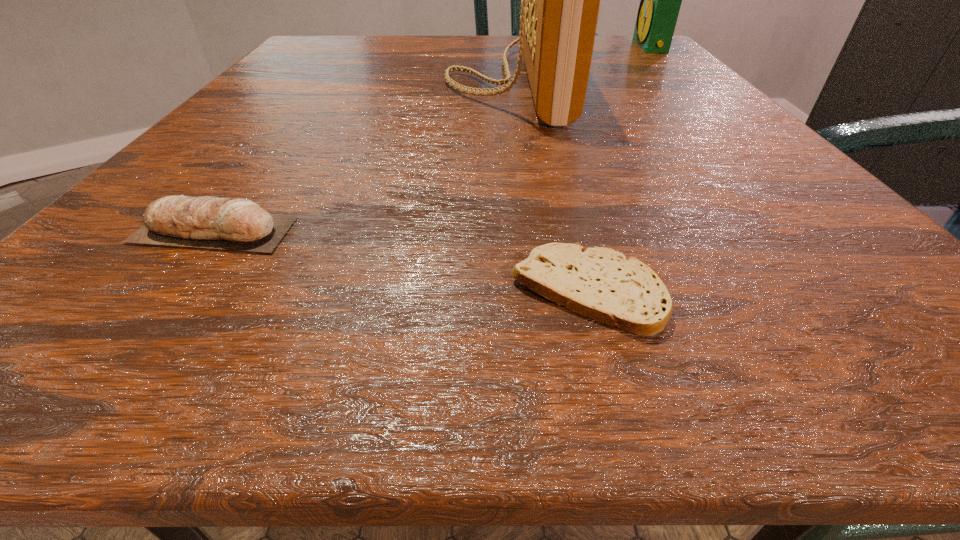
At what (x,y) coordinates should I click in order to perform the action: click on free region located on the front-facing side of the rightmost object. Please return your answer as a coordinate pair (x, y). This screenshot has width=960, height=540. Looking at the image, I should click on (584, 46).

Where is `free space located 0.110m on the front-facing side of the rightmost object`? This screenshot has width=960, height=540. free space located 0.110m on the front-facing side of the rightmost object is located at coordinates (588, 46).

What are the coordinates of `free space located on the front-facing side of the rightmost object` in the screenshot? It's located at (512, 46).

Locate an element on the screen. This screenshot has width=960, height=540. vacant space located on the back of the second shortest object is located at coordinates pyautogui.click(x=323, y=87).

Locate an element on the screen. The height and width of the screenshot is (540, 960). vacant area situated 0.050m on the back of the right pita bread is located at coordinates (569, 224).

Find the location of a particular element. This screenshot has height=540, width=960. handbag that is positioned at the far edge is located at coordinates (560, 0).

This screenshot has height=540, width=960. What are the coordinates of `alarm clock that is at the far edge` in the screenshot? It's located at (660, 0).

Locate an element on the screen. object that is at the near edge is located at coordinates (600, 283).

Locate an element on the screen. This screenshot has height=540, width=960. object present at the left edge is located at coordinates (239, 224).

Identify the location of object that is at the right edge. This screenshot has width=960, height=540. (660, 0).